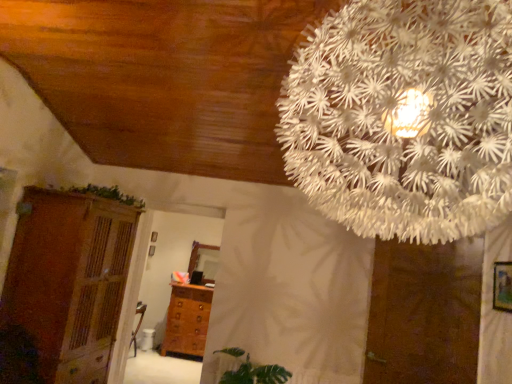
Question: Is brown matte door at lower right oriented away from white paper flower at upper center?

Choices:
 (A) no
 (B) yes

Answer: (A)

Question: Can you confirm if brown matte door at lower right is shorter than white paper flower at upper center?

Choices:
 (A) yes
 (B) no

Answer: (B)

Question: From the image's perspective, does brown matte door at lower right appear higher than white paper flower at upper center?

Choices:
 (A) yes
 (B) no

Answer: (B)

Question: Can you confirm if brown matte door at lower right is bigger than white paper flower at upper center?

Choices:
 (A) no
 (B) yes

Answer: (A)

Question: Is the depth of brown matte door at lower right less than that of white paper flower at upper center?

Choices:
 (A) no
 (B) yes

Answer: (A)

Question: Is brown matte door at lower right thinner than white paper flower at upper center?

Choices:
 (A) no
 (B) yes

Answer: (B)

Question: Could you tell me if wooden chest of drawers at center is turned towards wooden picture frame at right?

Choices:
 (A) no
 (B) yes

Answer: (A)

Question: From a real-world perspective, does wooden chest of drawers at center stand above wooden picture frame at right?

Choices:
 (A) no
 (B) yes

Answer: (A)

Question: Is wooden chest of drawers at center shorter than wooden picture frame at right?

Choices:
 (A) no
 (B) yes

Answer: (A)

Question: Is wooden chest of drawers at center wider than wooden picture frame at right?

Choices:
 (A) no
 (B) yes

Answer: (B)

Question: Does wooden chest of drawers at center have a greater height compared to wooden picture frame at right?

Choices:
 (A) yes
 (B) no

Answer: (A)

Question: Does wooden chest of drawers at center have a lesser width compared to wooden picture frame at right?

Choices:
 (A) no
 (B) yes

Answer: (A)

Question: Is wooden picture frame at right at the right side of brown wooden dresser at left?

Choices:
 (A) yes
 (B) no

Answer: (A)